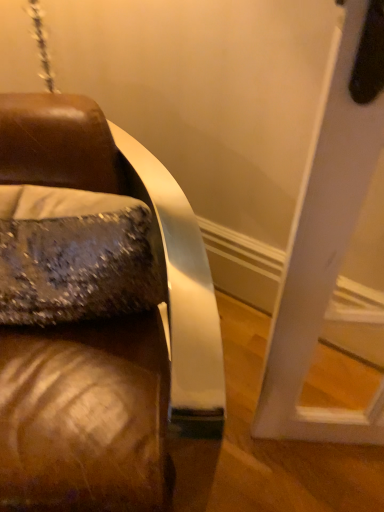
Question: From the image's perspective, is brown leather couch at left positioned above or below sparkly silver pillow at left?

Choices:
 (A) above
 (B) below

Answer: (B)

Question: Looking at their shapes, would you say brown leather couch at left is wider or thinner than sparkly silver pillow at left?

Choices:
 (A) wide
 (B) thin

Answer: (A)

Question: Which is correct: brown leather couch at left is inside sparkly silver pillow at left, or outside of it?

Choices:
 (A) inside
 (B) outside

Answer: (B)

Question: In terms of size, does sparkly silver pillow at left appear bigger or smaller than brown leather couch at left?

Choices:
 (A) small
 (B) big

Answer: (A)

Question: Considering the positions of sparkly silver pillow at left and brown leather couch at left in the image, is sparkly silver pillow at left wider or thinner than brown leather couch at left?

Choices:
 (A) wide
 (B) thin

Answer: (B)

Question: In terms of height, does sparkly silver pillow at left look taller or shorter compared to brown leather couch at left?

Choices:
 (A) tall
 (B) short

Answer: (B)

Question: Does point (31, 204) appear closer or farther from the camera than point (41, 154)?

Choices:
 (A) farther
 (B) closer

Answer: (B)